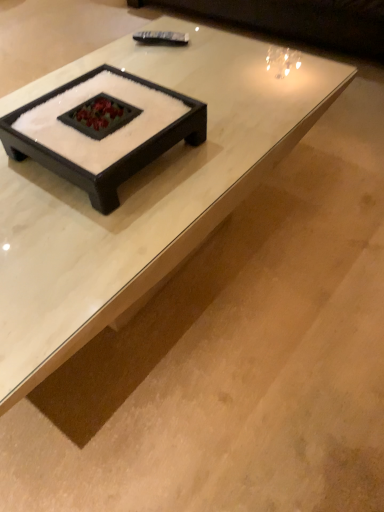
You are a GUI agent. You are given a task and a screenshot of the screen. Output one action in this format:
    pyautogui.click(x=<x>, y=<y>)
    Task: Click on the empty space that is ontop of white glossy coffee table at center (from a real-world perspective)
    
    Given the screenshot: What is the action you would take?
    pyautogui.click(x=152, y=151)